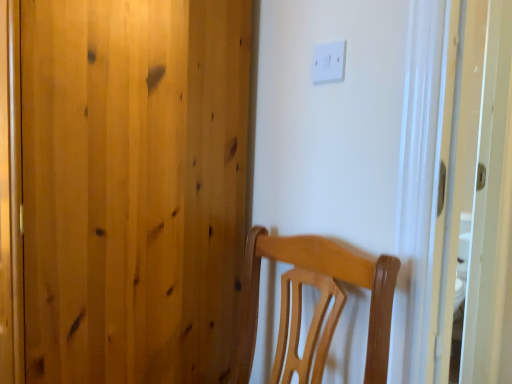
Locate an element on the screen. The height and width of the screenshot is (384, 512). natural wood door at center is located at coordinates (133, 188).

The height and width of the screenshot is (384, 512). What do you see at coordinates (133, 188) in the screenshot?
I see `natural wood door at center` at bounding box center [133, 188].

Where is `white plastic light switch at upper center`? The height and width of the screenshot is (384, 512). white plastic light switch at upper center is located at coordinates (329, 62).

Image resolution: width=512 pixels, height=384 pixels. Describe the element at coordinates (329, 62) in the screenshot. I see `white plastic light switch at upper center` at that location.

This screenshot has height=384, width=512. Identify the location of natural wood door at center. (133, 188).

Is natural wood door at center to the left or to the right of white plastic light switch at upper center in the image?

Clearly, natural wood door at center is on the left of white plastic light switch at upper center in the image.

Consider the image. Which is in front, natural wood door at center or white plastic light switch at upper center?

natural wood door at center is in front.

Considering the points (206, 325) and (326, 72), which point is in front, point (206, 325) or point (326, 72)?

The point (326, 72) is closer to the camera.

From the image's perspective, which one is positioned higher, natural wood door at center or white plastic light switch at upper center?

white plastic light switch at upper center, from the image's perspective.

From a real-world perspective, who is located lower, natural wood door at center or white plastic light switch at upper center?

From a 3D spatial view, natural wood door at center is below.

Does natural wood door at center have a lesser width compared to white plastic light switch at upper center?

No.

Is natural wood door at center taller or shorter than white plastic light switch at upper center?

Considering their sizes, natural wood door at center has more height than white plastic light switch at upper center.

Between natural wood door at center and white plastic light switch at upper center, which one has smaller size?

Smaller between the two is white plastic light switch at upper center.

Would you say natural wood door at center is inside or outside white plastic light switch at upper center?

natural wood door at center is spatially situated outside white plastic light switch at upper center.

Is natural wood door at center far away from white plastic light switch at upper center?

No, natural wood door at center is in close proximity to white plastic light switch at upper center.

Is natural wood door at center oriented away from white plastic light switch at upper center?

No, natural wood door at center is not facing the opposite direction of white plastic light switch at upper center.

Can you tell me how much natural wood door at center and white plastic light switch at upper center differ in facing direction?

0.631 degrees separate the facing orientations of natural wood door at center and white plastic light switch at upper center.

Identify the location of door that is under the white plastic light switch at upper center (from a real-world perspective). (133, 188).

Considering the positions of objects white plastic light switch at upper center and natural wood door at center in the image provided, who is more to the right, white plastic light switch at upper center or natural wood door at center?

Positioned to the right is white plastic light switch at upper center.

Considering the relative positions of white plastic light switch at upper center and natural wood door at center in the image provided, is white plastic light switch at upper center in front of natural wood door at center?

No, the depth of white plastic light switch at upper center is greater than that of natural wood door at center.

Which point is more distant from viewer, (326, 47) or (219, 378)?

The point (219, 378) is farther from the camera.

From the image's perspective, is white plastic light switch at upper center on top of natural wood door at center?

Yes, from the image's perspective, white plastic light switch at upper center is on top of natural wood door at center.

From a real-world perspective, who is located lower, white plastic light switch at upper center or natural wood door at center?

From a 3D spatial view, natural wood door at center is below.

In terms of width, does white plastic light switch at upper center look wider or thinner when compared to natural wood door at center?

In the image, white plastic light switch at upper center appears to be more narrow than natural wood door at center.

Considering the relative sizes of white plastic light switch at upper center and natural wood door at center in the image provided, is white plastic light switch at upper center shorter than natural wood door at center?

Yes, white plastic light switch at upper center is shorter than natural wood door at center.

Is white plastic light switch at upper center bigger or smaller than natural wood door at center?

Clearly, white plastic light switch at upper center is smaller in size than natural wood door at center.

Is white plastic light switch at upper center surrounding natural wood door at center?

That's incorrect, natural wood door at center is not inside white plastic light switch at upper center.

Would you say white plastic light switch at upper center is a long distance from natural wood door at center?

No.

Is white plastic light switch at upper center positioned with its back to natural wood door at center?

No, white plastic light switch at upper center's orientation is not away from natural wood door at center.

How much distance is there between white plastic light switch at upper center and natural wood door at center?

The distance of white plastic light switch at upper center from natural wood door at center is 19.94 inches.

I want to click on door beneath the white plastic light switch at upper center (from a real-world perspective), so click(x=133, y=188).

Find the location of `door located below the white plastic light switch at upper center (from the image's perspective)`. door located below the white plastic light switch at upper center (from the image's perspective) is located at coordinates (133, 188).

Find the location of a particular element. Image resolution: width=512 pixels, height=384 pixels. door that is in front of the white plastic light switch at upper center is located at coordinates (133, 188).